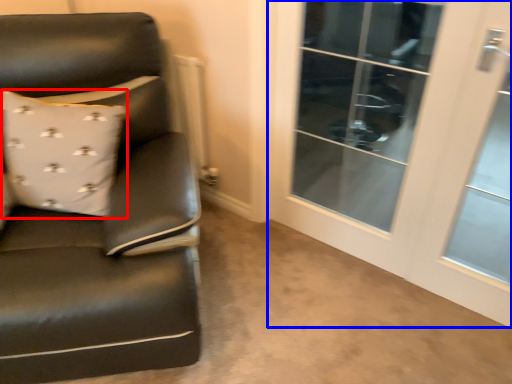
Question: Which object appears farthest to the camera in this image, pillow (highlighted by a red box) or screen door (highlighted by a blue box)?

Choices:
 (A) pillow
 (B) screen door

Answer: (A)